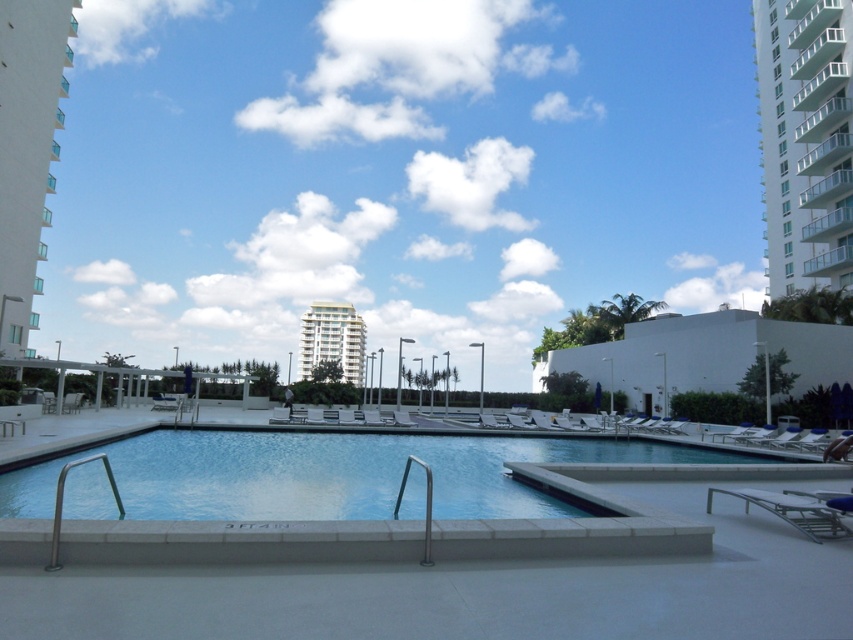
Question: Estimate the real-world distances between objects in this image. Which object is farther from the white glass building at left?

Choices:
 (A) clear glass pool at center
 (B) white glossy building at center
 (C) white concrete building at upper right

Answer: (C)

Question: Estimate the real-world distances between objects in this image. Which object is farther from the white glass building at left?

Choices:
 (A) white concrete building at upper right
 (B) clear glass pool at center
 (C) white glossy building at center

Answer: (A)

Question: Is the position of clear glass pool at center less distant than that of white concrete building at upper right?

Choices:
 (A) yes
 (B) no

Answer: (A)

Question: Does clear glass pool at center have a larger size compared to white glass building at left?

Choices:
 (A) yes
 (B) no

Answer: (B)

Question: Does white concrete building at upper right appear over white glass building at left?

Choices:
 (A) no
 (B) yes

Answer: (B)

Question: Among these objects, which one is farthest from the camera?

Choices:
 (A) white glass building at left
 (B) white glossy building at center

Answer: (B)